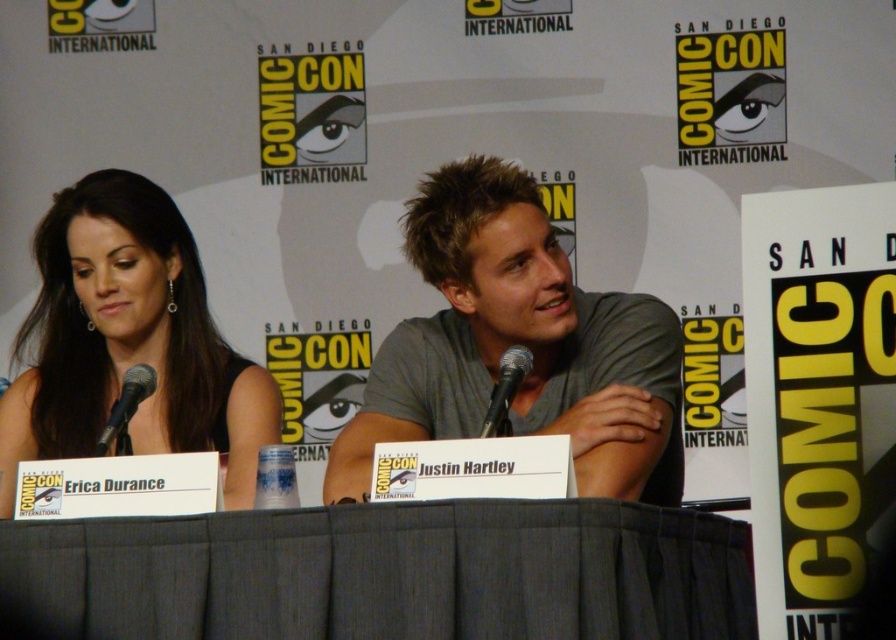
Question: Is gray fabric table at center to the right of black matte microphone at left from the viewer's perspective?

Choices:
 (A) yes
 (B) no

Answer: (A)

Question: Is gray fabric table at center bigger than matte black dress at left?

Choices:
 (A) yes
 (B) no

Answer: (B)

Question: Can you confirm if gray cotton shirt at center is smaller than black matte microphone at left?

Choices:
 (A) no
 (B) yes

Answer: (A)

Question: Among these objects, which one is nearest to the camera?

Choices:
 (A) gray cotton shirt at center
 (B) gray fabric table at center
 (C) black matte microphone at left

Answer: (B)

Question: Among these points, which one is farthest from the camera?

Choices:
 (A) (149, 369)
 (B) (507, 368)
 (C) (13, 403)
 (D) (582, 467)

Answer: (C)

Question: Which of these objects is positioned farthest from the black matte microphone at left?

Choices:
 (A) black metallic microphone at center
 (B) matte black dress at left

Answer: (A)